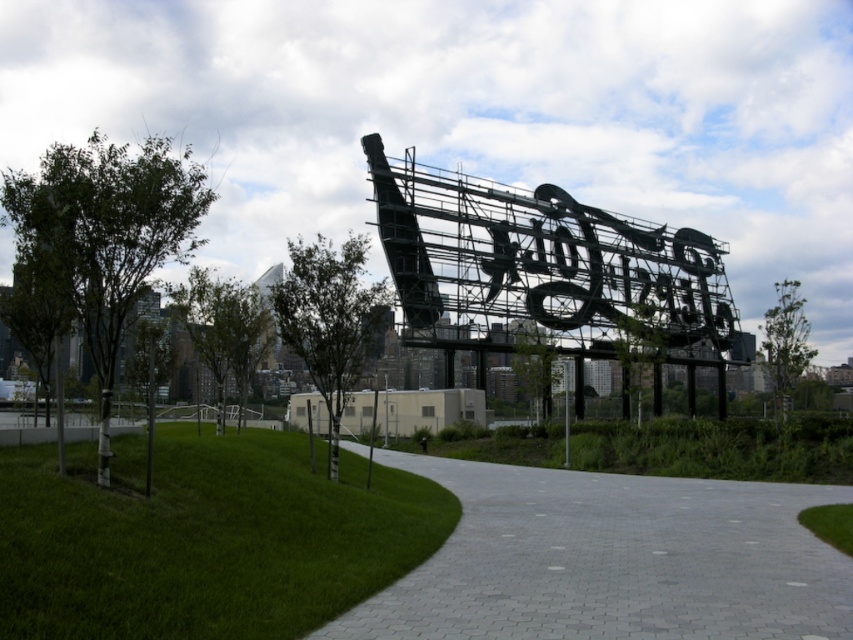
Does green grass at lower left appear on the right side of green grass at lower center?

Incorrect, green grass at lower left is not on the right side of green grass at lower center.

Does green grass at lower left have a larger size compared to green grass at lower center?

Incorrect, green grass at lower left is not larger than green grass at lower center.

Describe the element at coordinates (202, 536) in the screenshot. Image resolution: width=853 pixels, height=640 pixels. I see `green grass at lower left` at that location.

Where is `green grass at lower left`? The height and width of the screenshot is (640, 853). green grass at lower left is located at coordinates (202, 536).

Does gray paver path at center appear on the left side of green grass at lower center?

Indeed, gray paver path at center is positioned on the left side of green grass at lower center.

Which is in front, point (657, 484) or point (647, 464)?

Point (657, 484)

Identify the location of gray paver path at center. (612, 560).

Between green grass at lower left and gray paver path at center, which one has less height?

gray paver path at center

Is green grass at lower left below gray paver path at center?

No, green grass at lower left is not below gray paver path at center.

The height and width of the screenshot is (640, 853). What do you see at coordinates (202, 536) in the screenshot?
I see `green grass at lower left` at bounding box center [202, 536].

Locate an element on the screen. This screenshot has width=853, height=640. green grass at lower left is located at coordinates (202, 536).